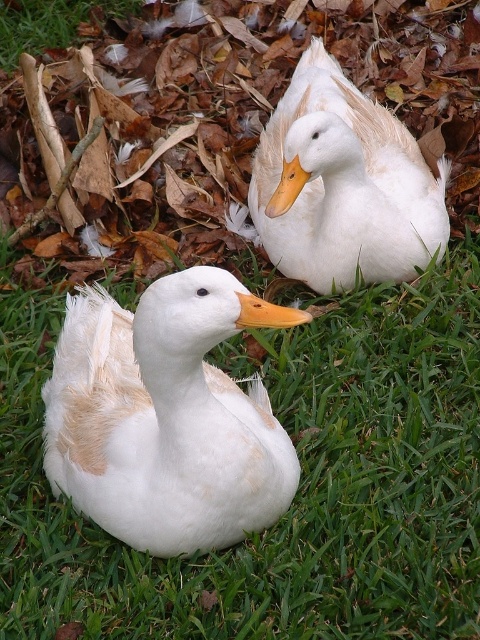
Consider the image. Who is positioned more to the right, white matte duck at center or orange matte beak at upper center?

white matte duck at center

Is point (324, 172) behind point (275, 212)?

Yes, point (324, 172) is behind point (275, 212).

I want to click on white matte duck at center, so click(x=343, y=184).

Consider the image. Between orange matte beak at center and orange matte beak at upper center, which one is positioned higher?

orange matte beak at upper center is higher up.

Is point (287, 314) less distant than point (304, 173)?

That is True.

The width and height of the screenshot is (480, 640). Find the location of `orange matte beak at center`. orange matte beak at center is located at coordinates (267, 314).

Between green grass at center and orange matte beak at center, which one appears on the left side from the viewer's perspective?

green grass at center is more to the left.

Between green grass at center and orange matte beak at center, which one is positioned higher?

orange matte beak at center is above.

This screenshot has width=480, height=640. Find the location of `green grass at center`. green grass at center is located at coordinates (298, 488).